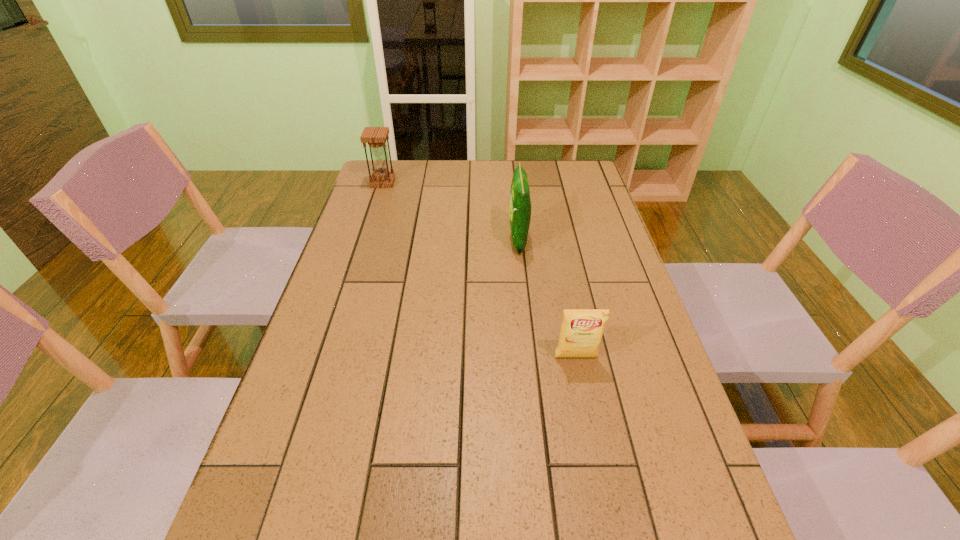
Where is `vacant area that lies between the second shortest object and the farther crisp (potato chip)`? The height and width of the screenshot is (540, 960). vacant area that lies between the second shortest object and the farther crisp (potato chip) is located at coordinates point(450,211).

Image resolution: width=960 pixels, height=540 pixels. Identify the location of free space that is in between the farther crisp (potato chip) and the second shortest object. (450, 211).

Where is `free space that is in between the shorter crisp (potato chip) and the farthest object`? This screenshot has height=540, width=960. free space that is in between the shorter crisp (potato chip) and the farthest object is located at coordinates (479, 270).

Find the location of a particular element. This screenshot has height=540, width=960. empty location between the farthest object and the rightmost object is located at coordinates (479, 270).

Locate which object ranks second in proximity to the right crisp (potato chip). Please provide its 2D coordinates. Your answer should be formatted as a tuple, i.e. [(x, y)], where the tuple contains the x and y coordinates of a point satisfying the conditions above.

[(376, 137)]

The image size is (960, 540). Find the location of `object that is the nearest to the shorter crisp (potato chip)`. object that is the nearest to the shorter crisp (potato chip) is located at coordinates (519, 204).